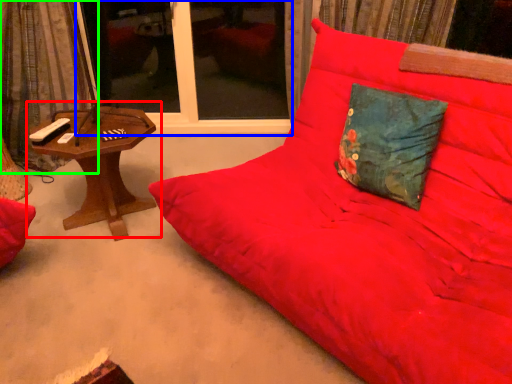
Question: Which object is positioned closest to table (highlighted by a red box)? Select from window screen (highlighted by a blue box) and curtain (highlighted by a green box).

Choices:
 (A) window screen
 (B) curtain

Answer: (B)